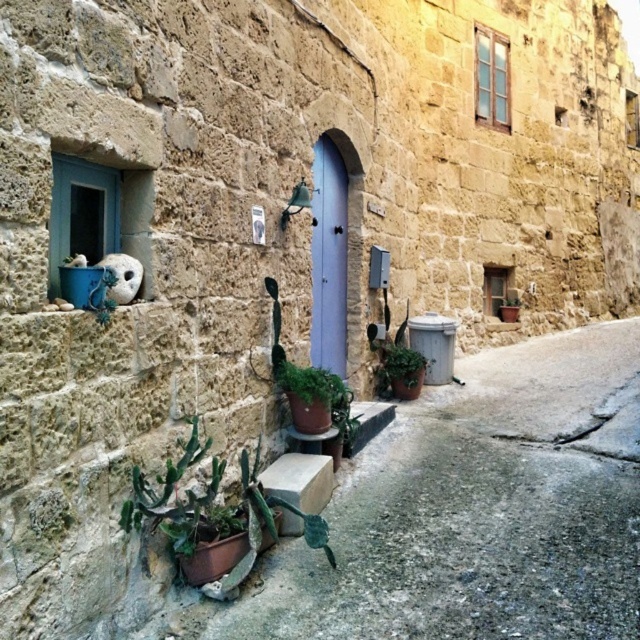
Question: Estimate the real-world distances between objects in this image. Which object is closer to the green matte plant at center?

Choices:
 (A) white stone cat at upper left
 (B) green succulent at lower left

Answer: (B)

Question: Does green succulent at lower left appear on the left side of green matte plant at center?

Choices:
 (A) yes
 (B) no

Answer: (A)

Question: Considering the real-world distances, which object is farthest from the white stone cat at upper left?

Choices:
 (A) green matte plant at center
 (B) green matte plant at lower right

Answer: (B)

Question: Is green succulent at lower left bigger than green matte plant at lower right?

Choices:
 (A) no
 (B) yes

Answer: (B)

Question: Does green matte plant at center have a lesser width compared to green matte plant at lower right?

Choices:
 (A) yes
 (B) no

Answer: (B)

Question: Which point is farther from the camera taking this photo?

Choices:
 (A) (132, 284)
 (B) (289, 365)

Answer: (B)